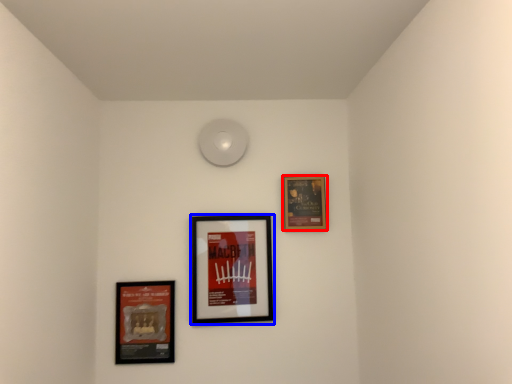
Question: Which object is further to the camera taking this photo, picture frame (highlighted by a red box) or picture frame (highlighted by a blue box)?

Choices:
 (A) picture frame
 (B) picture frame

Answer: (A)